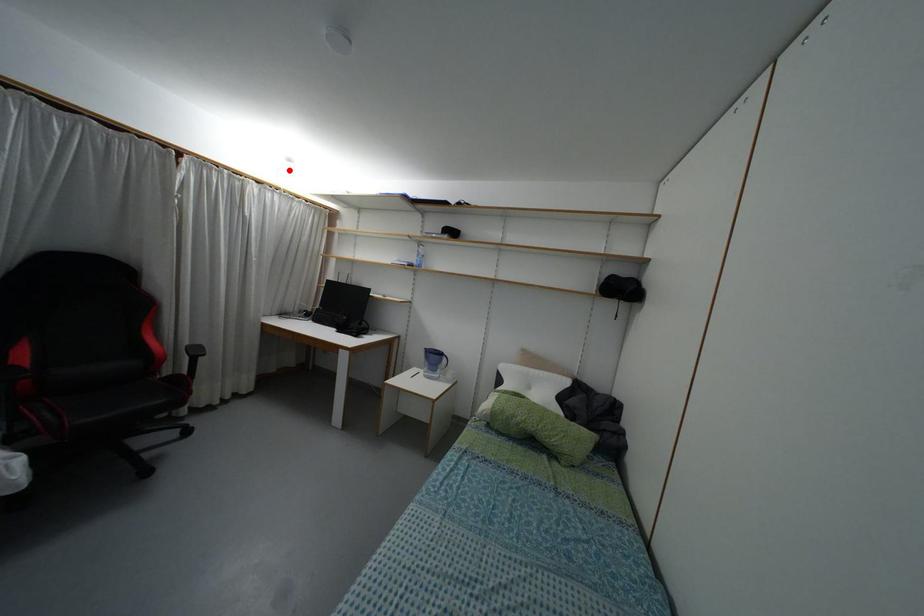
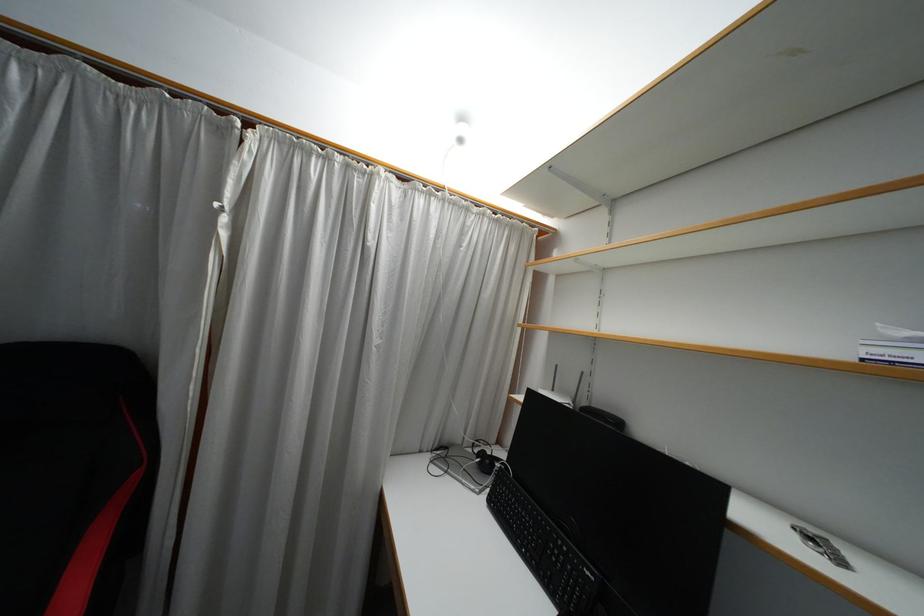
Where in the second image is the point corresponding to the highlighted location from the first image?

(459, 140)